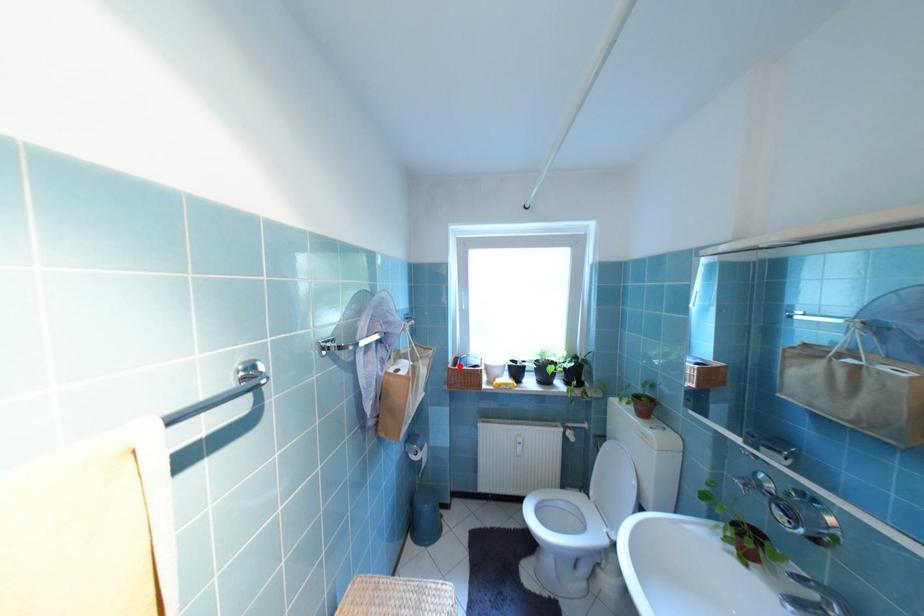
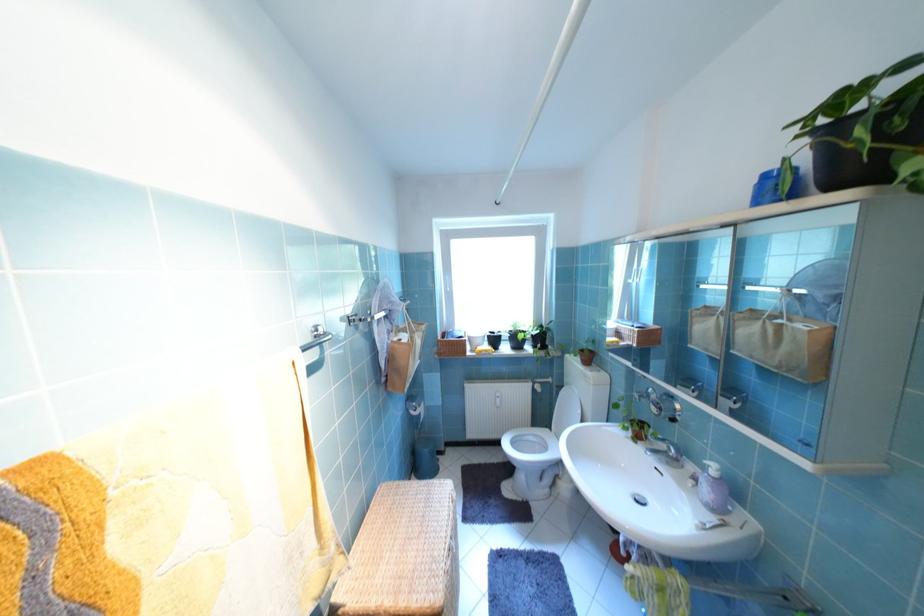
The point at the highlighted location is marked in the first image. Where is the corresponding point in the second image?

(448, 339)